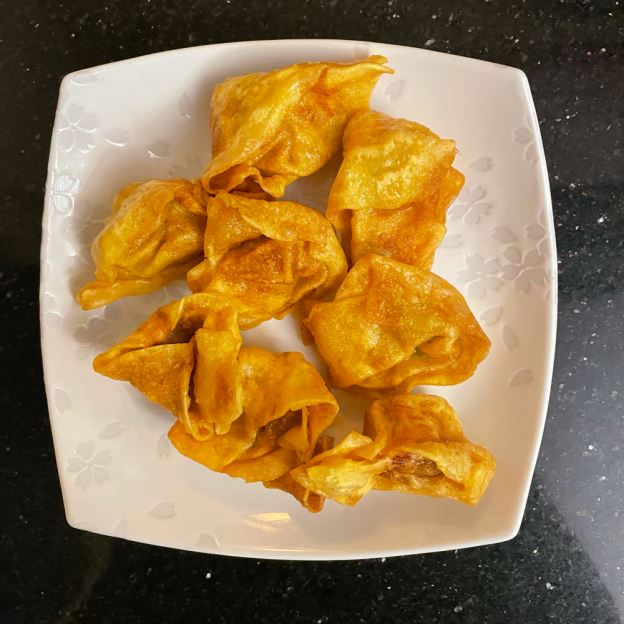
Identify the location of square white plate. (414, 537).